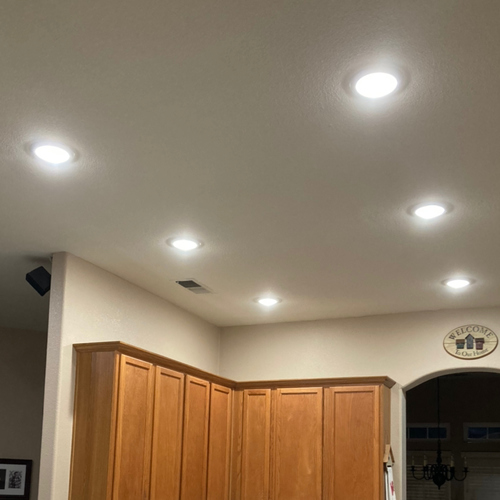
Image resolution: width=500 pixels, height=500 pixels. What are the coordinates of `speaker` in the screenshot? It's located at (38, 279).